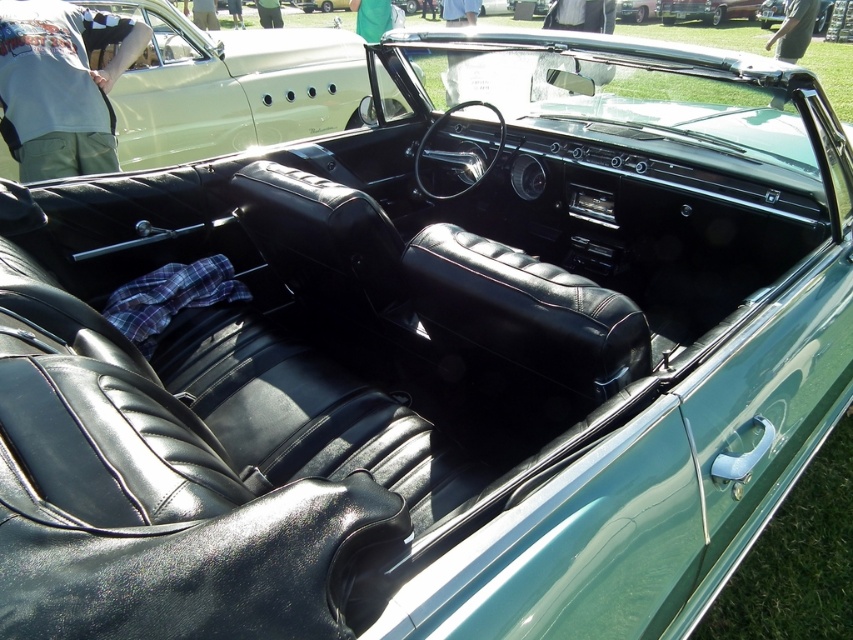
You are standing at point (207, 80) and want to reach the car door handle. The car door handle is located at point 0.325, 0.245. Can you reach it without moving your position?

The distance between point (207, 80) and the car door handle at 0.325, 0.245 is 4.86 meters, so you cannot reach it without moving your position.

From the picture: You are a car designer reviewing the vintage convertible car interior. You need to place a new cup holder exactly at the center of the car. Given the coordinates of the matte black leather seats at center, can you determine if the cup holder will be placed directly in front of the seats?

The 2D location of the matte black leather seats at center is at point (229, 86). Since the cup holder is to be placed at the center of the car, which is typically at coordinates (426, 320), it will not be directly in front of the seats as their coordinates are different.